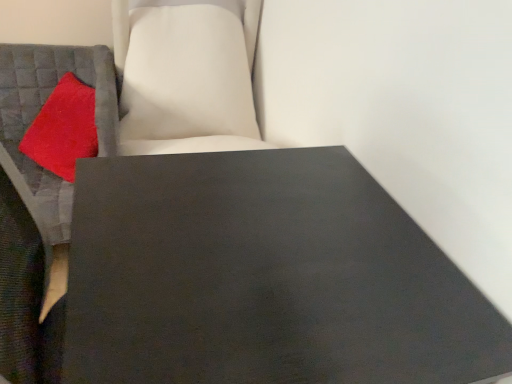
The image size is (512, 384). What are the coordinates of `matte black table at center` in the screenshot? It's located at (264, 278).

Does velvety red pillow at left have a lesser height compared to matte black table at center?

Indeed, velvety red pillow at left has a lesser height compared to matte black table at center.

Is velvety red pillow at left aimed at matte black table at center?

Yes, velvety red pillow at left is aimed at matte black table at center.

Can we say velvety red pillow at left lies outside matte black table at center?

velvety red pillow at left is positioned outside matte black table at center.

Does point (102, 85) come in front of point (44, 155)?

No.

Who is more distant, matte gray cushion at left or velvety red pillow at left?

velvety red pillow at left.

Considering the sizes of matte gray cushion at left and velvety red pillow at left in the image, is matte gray cushion at left taller or shorter than velvety red pillow at left?

Considering their sizes, matte gray cushion at left has more height than velvety red pillow at left.

Considering the sizes of matte gray cushion at left and velvety red pillow at left in the image, is matte gray cushion at left wider or thinner than velvety red pillow at left?

In the image, matte gray cushion at left appears to be wider than velvety red pillow at left.

From the image's perspective, does matte black table at center appear lower than matte gray cushion at left?

Yes.

Would you say matte black table at center is outside matte gray cushion at left?

That's correct, matte black table at center is outside of matte gray cushion at left.

Is matte black table at center positioned with its back to matte gray cushion at left?

No, matte black table at center's orientation is not away from matte gray cushion at left.

Between point (184, 189) and point (84, 50), which one is positioned in front?

The point (184, 189) is closer to the camera.

Does matte gray cushion at left turn towards matte black table at center?

No.

Consider the image. Is matte gray cushion at left surrounding matte black table at center?

No, matte black table at center is not inside matte gray cushion at left.

Considering their positions, is matte gray cushion at left located in front of or behind matte black table at center?

In the image, matte gray cushion at left appears behind matte black table at center.

Who is shorter, matte gray cushion at left or matte black table at center?

With less height is matte gray cushion at left.

Considering the relative sizes of velvety red pillow at left and matte gray cushion at left in the image provided, is velvety red pillow at left bigger than matte gray cushion at left?

Incorrect, velvety red pillow at left is not larger than matte gray cushion at left.

Considering their positions, is velvety red pillow at left located in front of or behind matte gray cushion at left?

velvety red pillow at left is positioned farther from the viewer than matte gray cushion at left.

Considering the positions of points (62, 138) and (116, 141), is point (62, 138) farther from camera compared to point (116, 141)?

Yes, point (62, 138) is behind point (116, 141).

From a real-world perspective, does matte black table at center sit lower than velvety red pillow at left?

Yes, from a real-world perspective, matte black table at center is beneath velvety red pillow at left.

Is matte black table at center oriented away from velvety red pillow at left?

That's not correct — matte black table at center is not looking away from velvety red pillow at left.

Does matte black table at center come in front of velvety red pillow at left?

Yes, matte black table at center is in front of velvety red pillow at left.

Is point (301, 253) less distant than point (41, 120)?

Yes, it is in front of point (41, 120).

The image size is (512, 384). What are the coordinates of `throw pillow above the matte black table at center (from a real-world perspective)` in the screenshot? It's located at (63, 129).

Identify the location of furniture below the velvety red pillow at left (from the image's perspective). Image resolution: width=512 pixels, height=384 pixels. (32, 121).

Which object lies further to the anchor point matte gray cushion at left, matte black table at center or velvety red pillow at left?

Among the two, matte black table at center is located further to matte gray cushion at left.

When comparing their distances from matte black table at center, does velvety red pillow at left or matte gray cushion at left seem closer?

Among the two, matte gray cushion at left is located nearer to matte black table at center.

When comparing their distances from matte gray cushion at left, does velvety red pillow at left or matte black table at center seem closer?

The object closer to matte gray cushion at left is velvety red pillow at left.

Considering their positions, is matte gray cushion at left positioned closer to velvety red pillow at left than matte black table at center?

matte gray cushion at left is positioned closer to the anchor velvety red pillow at left.

Considering their positions, is matte gray cushion at left positioned further to matte black table at center than velvety red pillow at left?

The object further to matte black table at center is velvety red pillow at left.

Estimate the real-world distances between objects in this image. Which object is closer to velvety red pillow at left, matte black table at center or matte gray cushion at left?

matte gray cushion at left.

I want to click on furniture between matte black table at center and velvety red pillow at left along the z-axis, so click(32, 121).